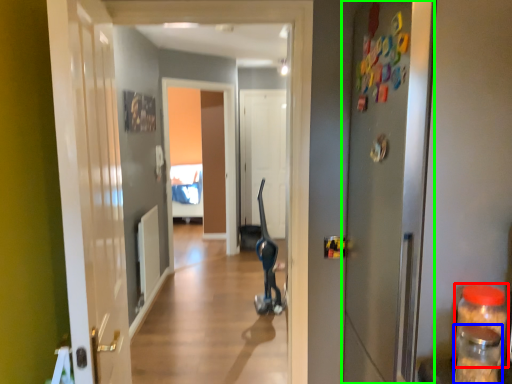
Question: Considering the real-world distances, which object is closest to bottle (highlighted by a red box)? bottle (highlighted by a blue box) or door (highlighted by a green box).

Choices:
 (A) bottle
 (B) door

Answer: (A)